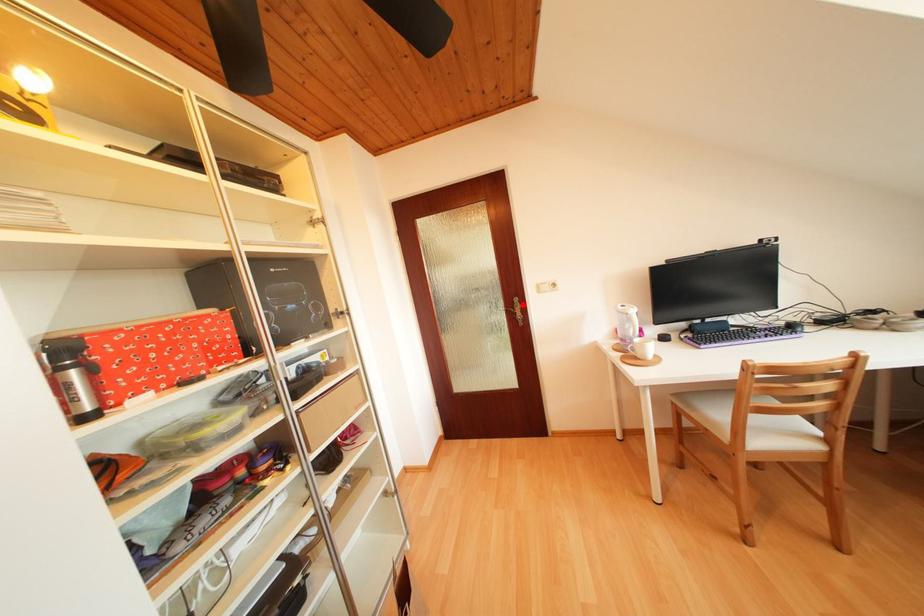
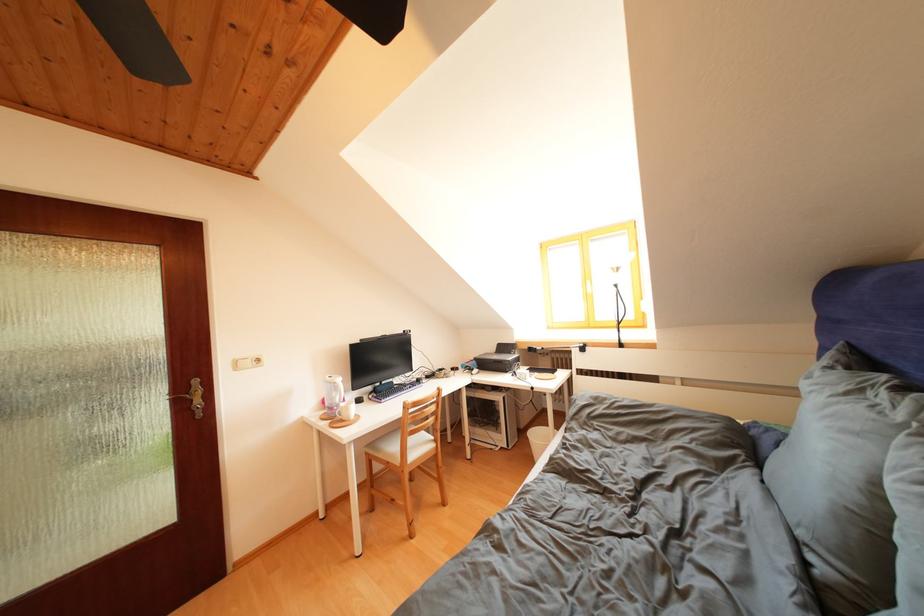
Where in the second image is the point corresponding to the highlighted location from the first image?

(201, 387)